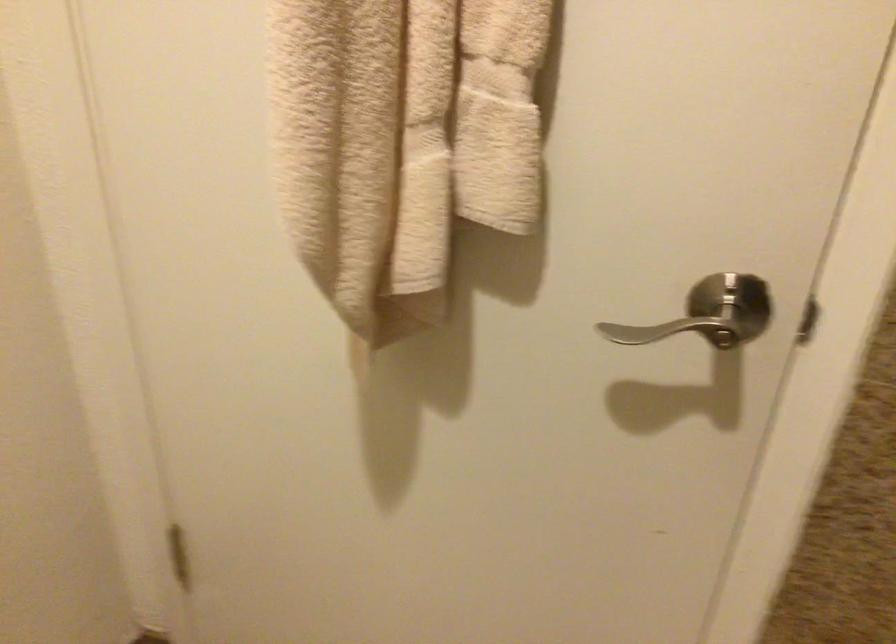
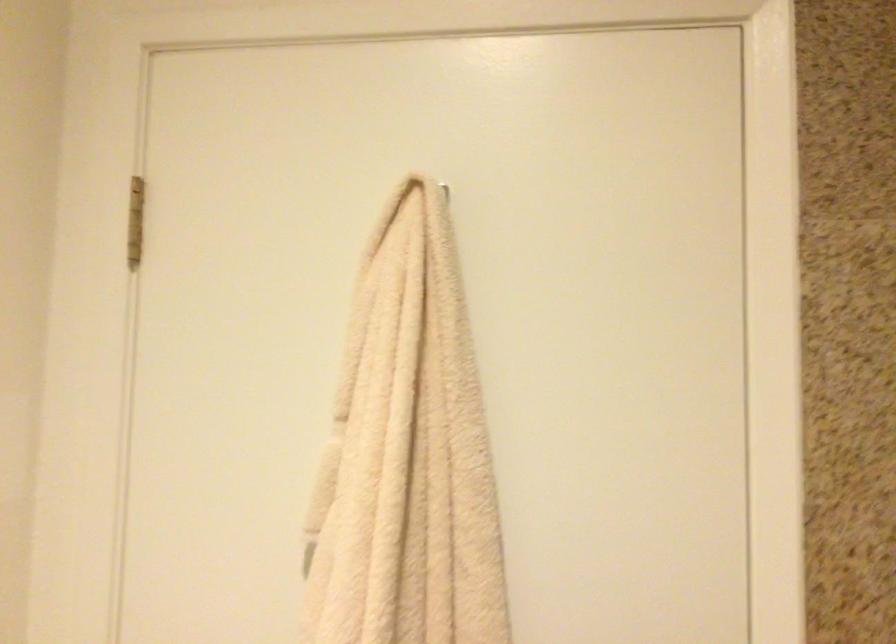
Question: Based on the continuous images, in which direction is the camera rotating? Reply with the corresponding letter.

Choices:
 (A) Left
 (B) Right
 (C) Up
 (D) Down

Answer: (C)